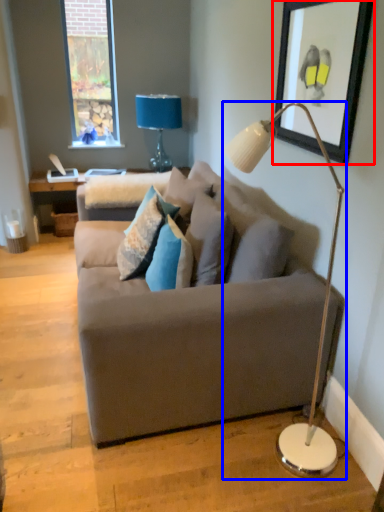
Question: Which of the following is the farthest to the observer, picture frame (highlighted by a red box) or lamp (highlighted by a blue box)?

Choices:
 (A) picture frame
 (B) lamp

Answer: (A)